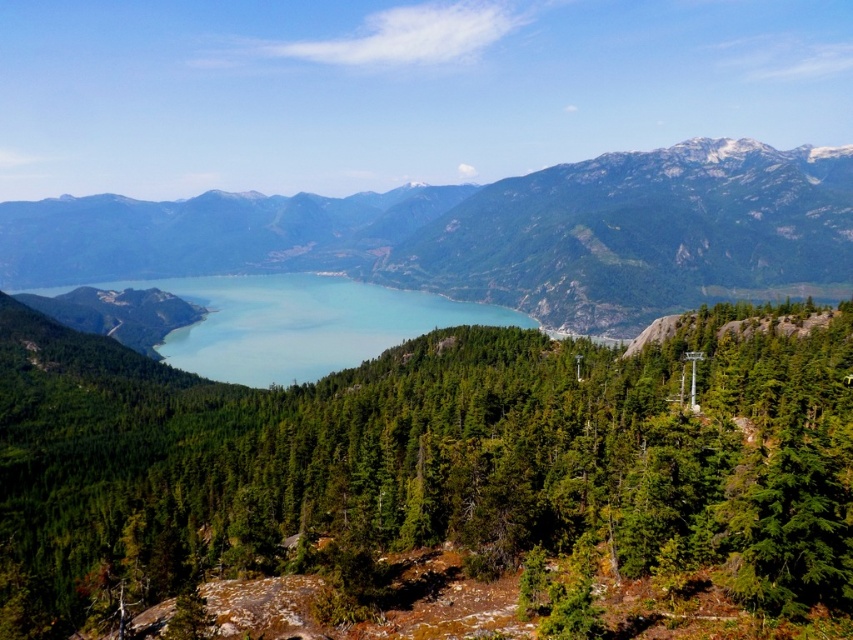
Question: Does green matte tree at center have a greater width compared to blue glassy water at center?

Choices:
 (A) no
 (B) yes

Answer: (A)

Question: Is green matte tree at center in front of blue glassy water at center?

Choices:
 (A) no
 (B) yes

Answer: (B)

Question: Does green matte tree at center appear on the left side of green textured mountain at center?

Choices:
 (A) yes
 (B) no

Answer: (B)

Question: Which is nearer to the green textured mountain at center?

Choices:
 (A) green matte tree at center
 (B) blue glassy water at center

Answer: (B)

Question: Which object is closer to the camera taking this photo?

Choices:
 (A) green textured mountain at center
 (B) blue glassy water at center

Answer: (B)

Question: Which of these objects is positioned closest to the green matte tree at center?

Choices:
 (A) green textured mountain at center
 (B) blue glassy water at center

Answer: (B)